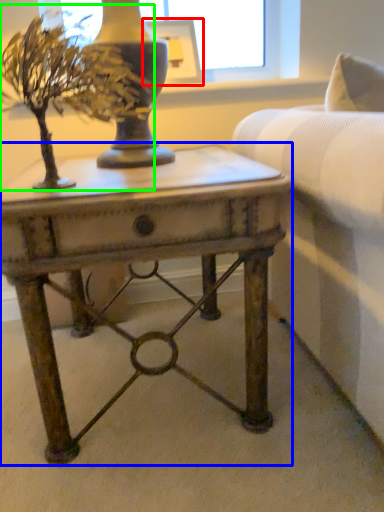
Question: Considering the real-world distances, which object is farthest from picture frame (highlighted by a red box)? table (highlighted by a blue box) or houseplant (highlighted by a green box)?

Choices:
 (A) table
 (B) houseplant

Answer: (A)